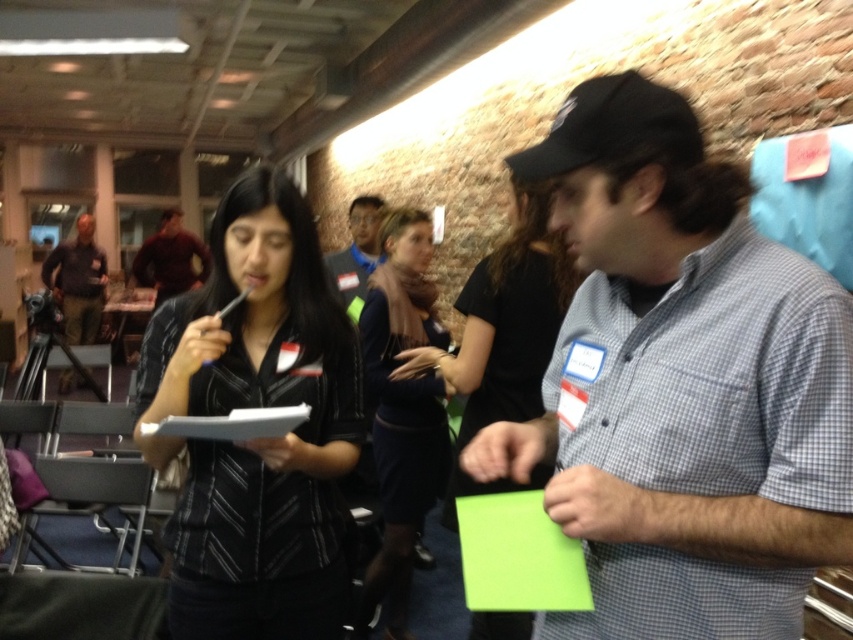
You are organizing a photo shoot and need to arrange two items in the scene so that they are both visible in the frame. The items are the black leather jacket at center and the blue shirt at center. Based on their sizes, which item should you place closer to the camera to ensure both are fully visible?

The black leather jacket at center is taller than the blue shirt at center. To ensure both are fully visible, place the taller black leather jacket at center closer to the camera so that the blue shirt at center can be positioned slightly behind without being obscured by the jacket.

You are organizing a fashion show and need to arrange the dark blue dress at center and the blue shirt at center on a mannequin. Which item should be placed higher up on the mannequin to match their actual sizes?

The dark blue dress at center should be placed higher up on the mannequin since it has a greater height compared to the blue shirt at center.

You are a person standing at the point marked by the coordinates point at (376, 358). You want to hand a document to the woman wearing a black and white striped shirt. Can you reach her without moving from your current position?

The distance between you and the woman wearing a black and white striped shirt is 2.38 meters. Since the average human arm length is about 0.7 meters, you cannot reach her without moving closer.